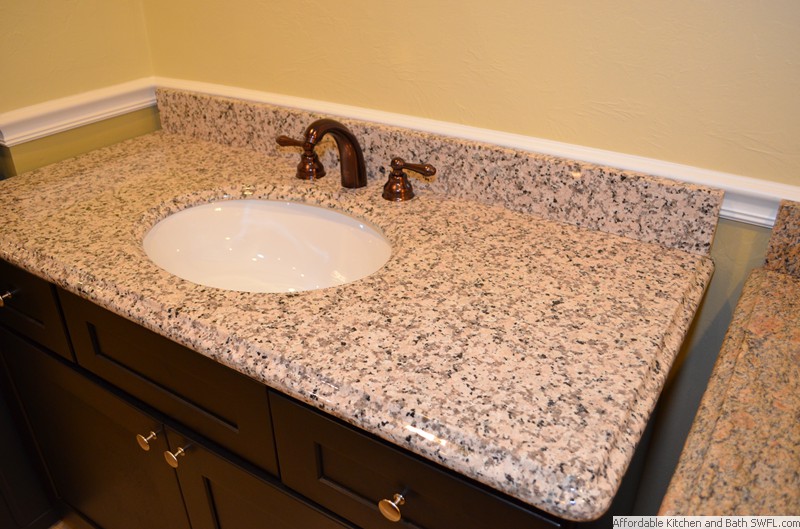
The width and height of the screenshot is (800, 529). Identify the location of wall. (26, 498).